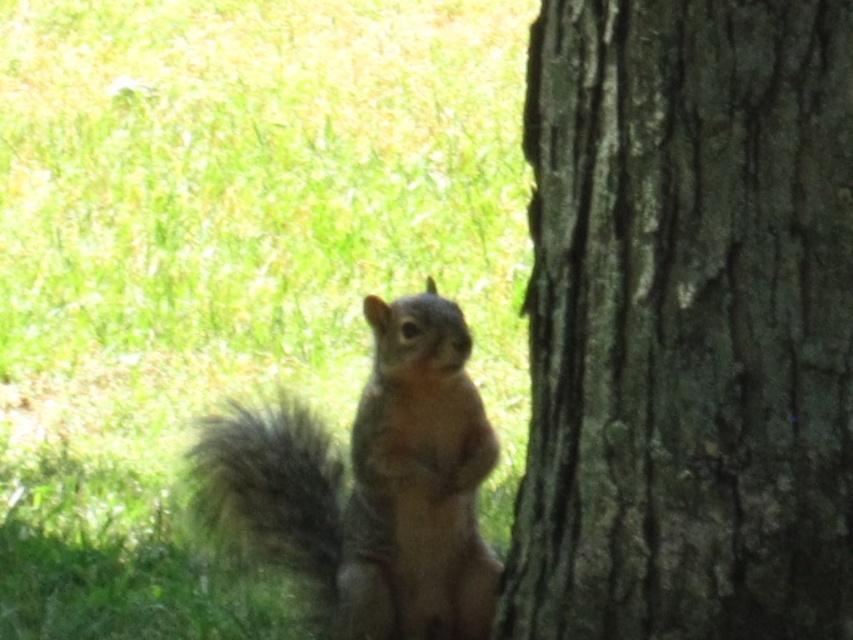
You are a photographer trying to capture the squirrel in the scene. You want to ensure the green grass at lower left and dark brown rough bark at right are both visible in your shot. Which object should you focus on to include both in the frame?

The green grass at lower left is bigger than dark brown rough bark at right, so focusing on the green grass at lower left would allow both objects to be captured in the frame since it occupies more space.

You are a photographer aiming to capture a closeup of the squirrel while standing at the lower left corner of the image. Given that the green grass at lower left is 3.28 meters away from your camera, can you estimate how far you need to move forward to ensure the squirrel is in focus?

Since the green grass at lower left is 3.28 meters away from the camera, you need to move forward to reduce the distance between the camera and the squirrel to ensure it is in focus. However, the exact distance adjustment depends on the camera lens and desired focus range, which are not specified here.